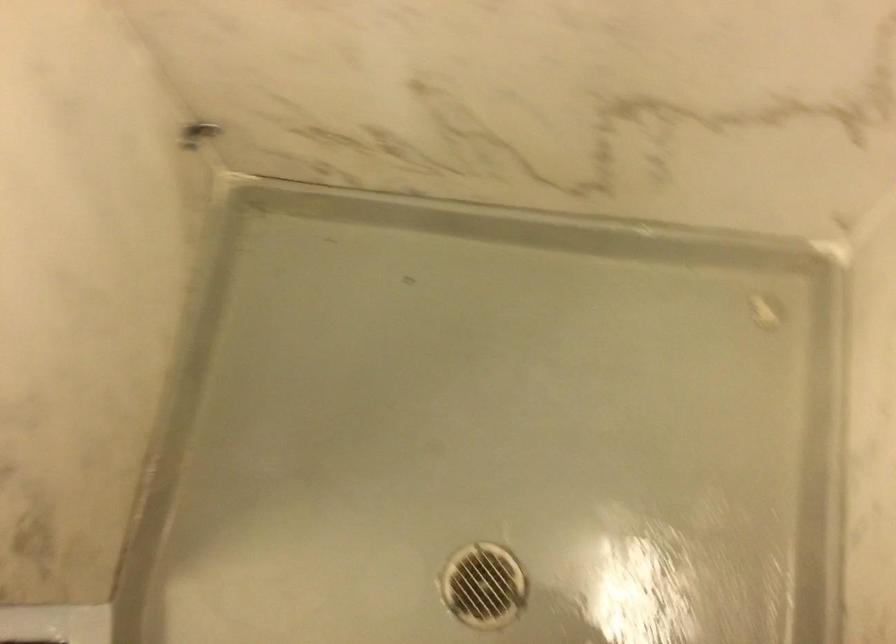
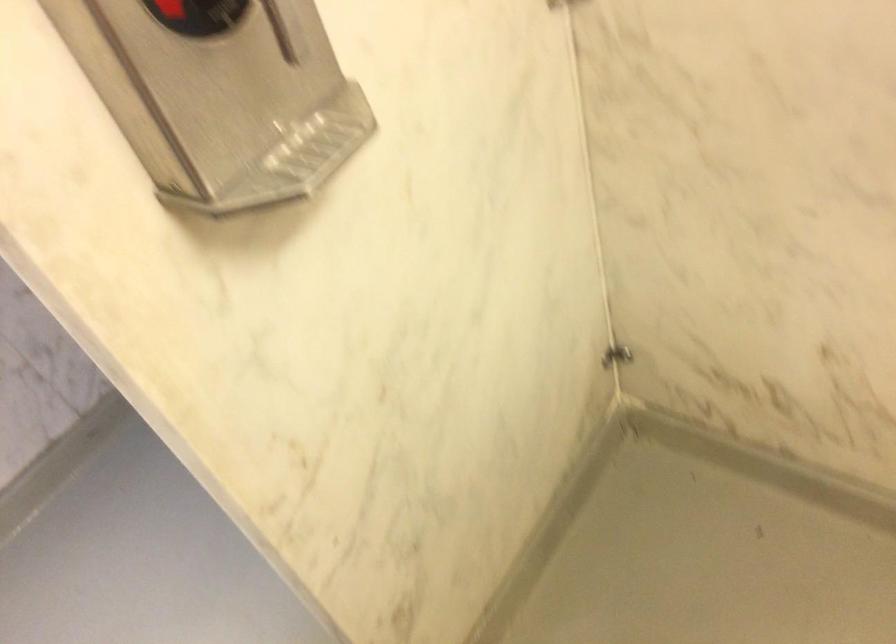
In the second image, find the point that corresponds to the point at 195,131 in the first image.

(616, 355)